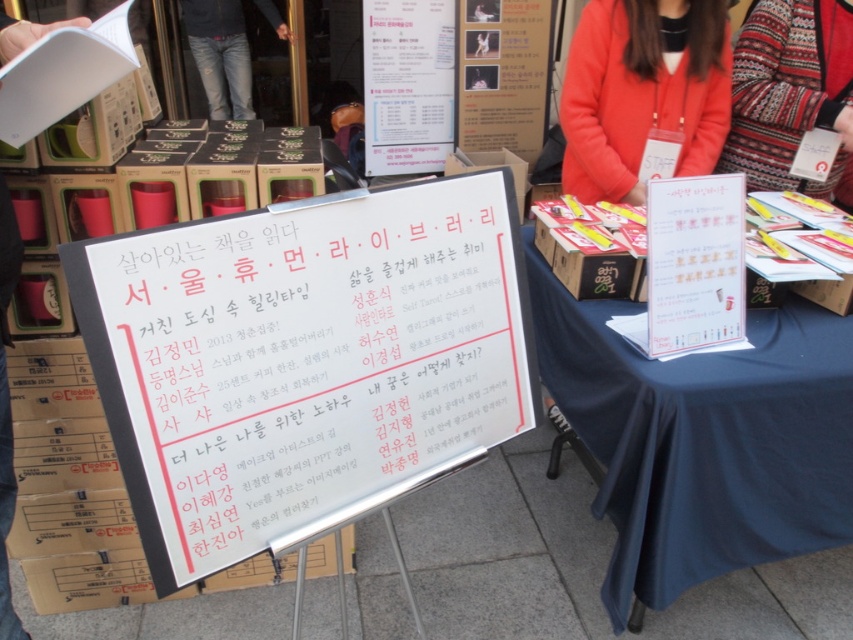
Does white paperboard at center lie in front of matte orange jacket at upper right?

Yes, white paperboard at center is in front of matte orange jacket at upper right.

Can you confirm if white paperboard at center is smaller than matte orange jacket at upper right?

No.

Which is behind, point (508, 372) or point (709, 150)?

Positioned behind is point (709, 150).

Identify the location of white paperboard at center. Image resolution: width=853 pixels, height=640 pixels. click(305, 362).

Is matte orange jacket at upper right wider than jeans at center?

No, matte orange jacket at upper right is not wider than jeans at center.

Is matte orange jacket at upper right closer to the viewer compared to jeans at center?

Yes, matte orange jacket at upper right is in front of jeans at center.

Is point (636, 145) positioned before point (212, 16)?

Yes.

This screenshot has height=640, width=853. Find the location of `matte orange jacket at upper right`. matte orange jacket at upper right is located at coordinates (643, 93).

Can you confirm if white paperboard at center is positioned above knitted sweater at upper right?

Actually, white paperboard at center is below knitted sweater at upper right.

Who is shorter, white paperboard at center or knitted sweater at upper right?

Standing shorter between the two is knitted sweater at upper right.

Which is in front, point (289, 218) or point (740, 81)?

Point (289, 218) is in front.

Where is `white paperboard at center`? The width and height of the screenshot is (853, 640). white paperboard at center is located at coordinates (305, 362).